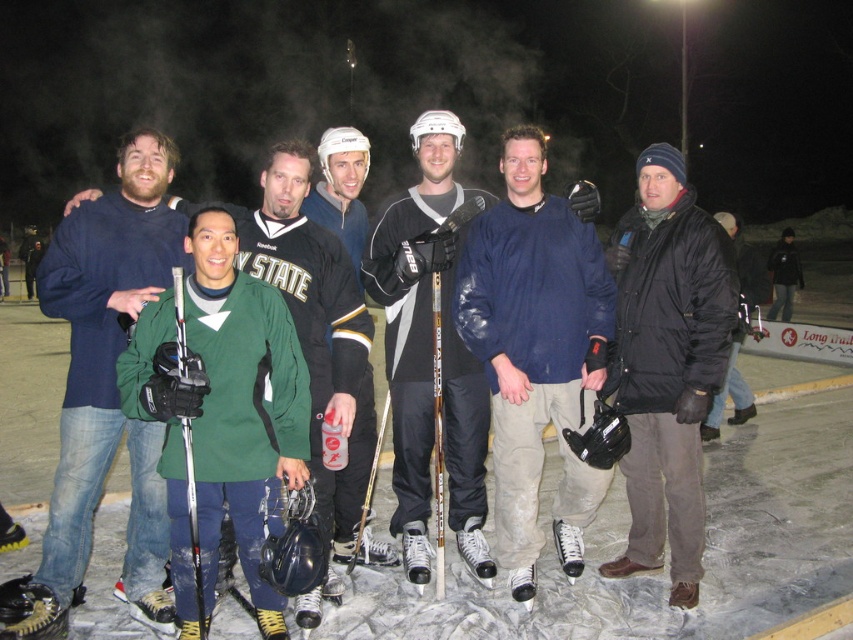
You are a photographer trying to capture a clear shot of the black puffy jacket at center without the green matte hockey stick at left blocking it. What adjustment should you make to your camera position?

Move your camera position backward to ensure the black puffy jacket at center is visible without obstruction from the green matte hockey stick at left, which is currently in front of it.